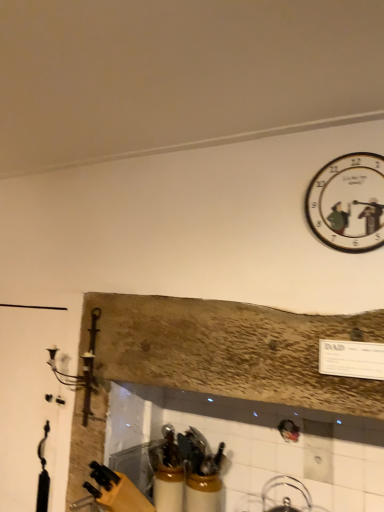
This screenshot has height=512, width=384. What do you see at coordinates (348, 203) in the screenshot? I see `wooden clock at upper right` at bounding box center [348, 203].

The width and height of the screenshot is (384, 512). What are the coordinates of `wooden clock at upper right` in the screenshot? It's located at (348, 203).

At what (x,y) coordinates should I click in order to perform the action: click on wooden clock at upper right. Please return your answer as a coordinate pair (x, y). This screenshot has width=384, height=512. Looking at the image, I should click on (x=348, y=203).